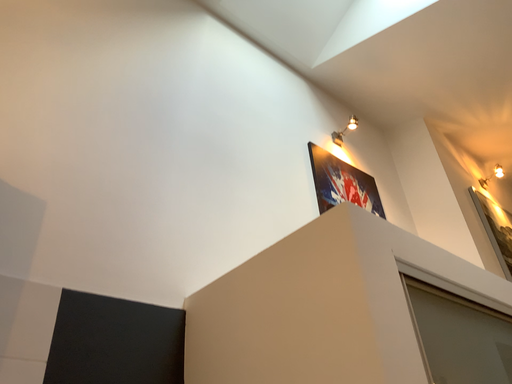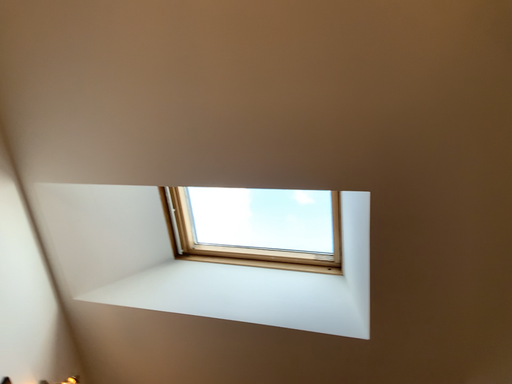
Question: Which way did the camera rotate in the video?

Choices:
 (A) rotated downward
 (B) rotated upward

Answer: (B)